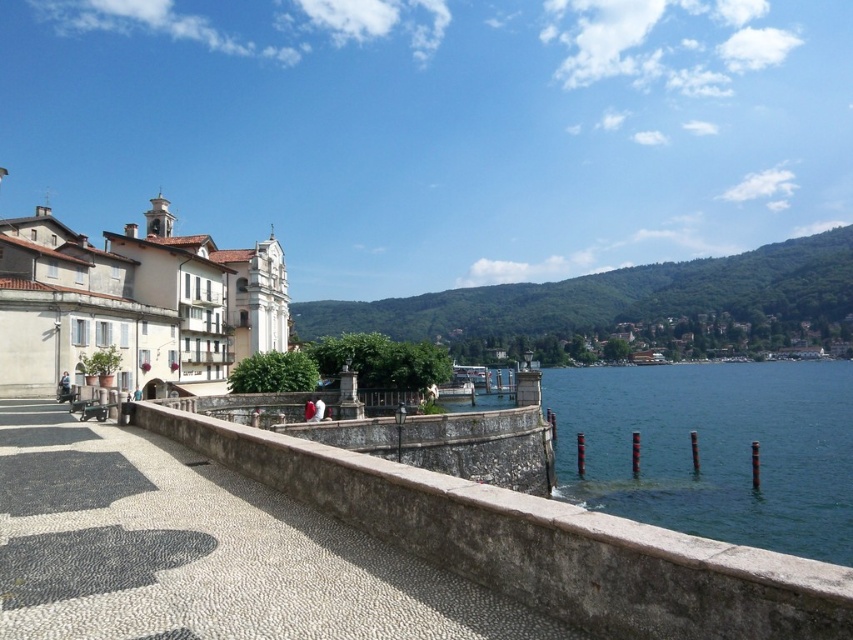
You are standing at the edge of the riverside scene described. You want to walk straight ahead towards the center of the image. Will the gray stone path at center be directly in your path?

A: The gray stone path at center is located at coordinates point (200, 552), which corresponds to the center area of the image. Therefore, walking straight ahead towards the center would place the gray stone path at center directly in your path.

You are standing at the riverside and want to take a photo that includes both the point at coordinates point [4,628] and the point at coordinates point [819,552]. Which point should you position closer to the camera to ensure both are in focus?

To ensure both points are in focus, position the camera closer to point [4,628] since it is nearer to the viewer than point [819,552]. This way, the depth of field will cover both points more effectively.